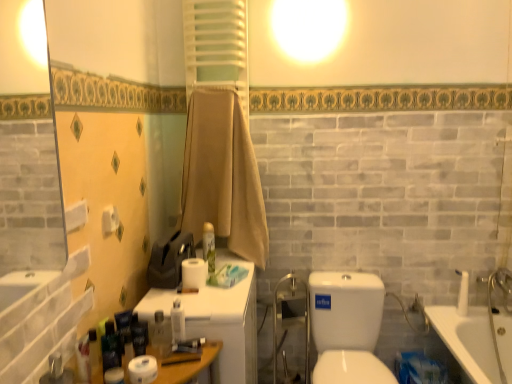
Question: Can you confirm if translucent plastic bottle at center, which is counted as the fourth toiletry, starting from the left, is shorter than beige cotton towel at center?

Choices:
 (A) no
 (B) yes

Answer: (B)

Question: From a real-world perspective, is translucent plastic bottle at center, which is counted as the fourth toiletry, starting from the left, on top of beige cotton towel at center?

Choices:
 (A) yes
 (B) no

Answer: (B)

Question: Is translucent plastic bottle at center, which is counted as the fourth toiletry, starting from the left, to the left of beige cotton towel at center from the viewer's perspective?

Choices:
 (A) no
 (B) yes

Answer: (B)

Question: Is translucent plastic bottle at center, which is counted as the fourth toiletry, starting from the left, touching beige cotton towel at center?

Choices:
 (A) no
 (B) yes

Answer: (A)

Question: From the image's perspective, would you say translucent plastic bottle at center, the 4th toiletry when ordered from front to back, is positioned over beige cotton towel at center?

Choices:
 (A) no
 (B) yes

Answer: (A)

Question: Is translucent plastic bottle at center, the second toiletry in the right-to-left sequence, far from beige cotton towel at center?

Choices:
 (A) yes
 (B) no

Answer: (B)

Question: Can you confirm if white matte roll of toilet paper at lower left, the 4th toiletry when ordered from right to left, is thinner than white matte toilet paper at center, marked as the first toilet paper in a right-to-left arrangement?

Choices:
 (A) no
 (B) yes

Answer: (B)

Question: Can you confirm if white matte roll of toilet paper at lower left, the second toiletry in the left-to-right sequence, is positioned to the left of white matte toilet paper at center, which is the 2th toilet paper in front-to-back order?

Choices:
 (A) no
 (B) yes

Answer: (B)

Question: Is white matte roll of toilet paper at lower left, the 5th toiletry viewed from the back, at the right side of white matte toilet paper at center, the 1th toilet paper positioned from the top?

Choices:
 (A) yes
 (B) no

Answer: (B)

Question: Considering the relative positions of white matte roll of toilet paper at lower left, the 4th toiletry when ordered from right to left, and white matte toilet paper at center, positioned as the 2th toilet paper in bottom-to-top order, in the image provided, is white matte roll of toilet paper at lower left, the 4th toiletry when ordered from right to left, behind white matte toilet paper at center, positioned as the 2th toilet paper in bottom-to-top order,?

Choices:
 (A) no
 (B) yes

Answer: (A)

Question: Can you confirm if white matte roll of toilet paper at lower left, the 5th toiletry viewed from the back, is smaller than white matte toilet paper at center, acting as the 2th toilet paper starting from the left?

Choices:
 (A) yes
 (B) no

Answer: (A)

Question: From a real-world perspective, is white matte roll of toilet paper at lower left, the 5th toiletry viewed from the back, located higher than white matte toilet paper at center, marked as the first toilet paper in a right-to-left arrangement?

Choices:
 (A) yes
 (B) no

Answer: (B)

Question: From the image's perspective, is white plastic medicine cabinet at center below white matte roll of toilet paper at lower left, the second toiletry in the left-to-right sequence?

Choices:
 (A) yes
 (B) no

Answer: (A)